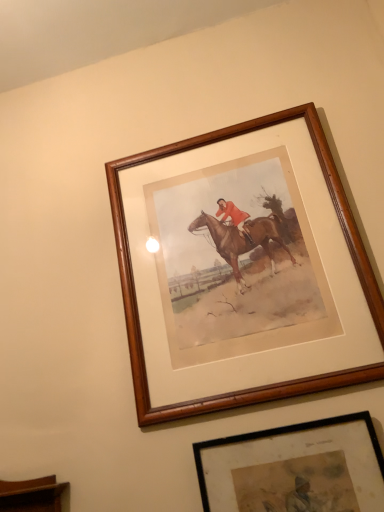
Image resolution: width=384 pixels, height=512 pixels. What do you see at coordinates (135, 290) in the screenshot? I see `wooden frame at upper center, which appears as the 2th picture frame when ordered from the bottom` at bounding box center [135, 290].

In order to face wooden frame at upper center, which appears as the 2th picture frame when ordered from the bottom, should I rotate leftwards or rightwards?

Turn right by 5.523 degrees to look at wooden frame at upper center, which appears as the 2th picture frame when ordered from the bottom.

Locate an element on the screen. This screenshot has width=384, height=512. wooden frame at upper center, marked as the first picture frame in a top-to-bottom arrangement is located at coordinates (135, 290).

What do you see at coordinates (294, 468) in the screenshot?
I see `wooden framed print at center, placed as the second picture frame when sorted from top to bottom` at bounding box center [294, 468].

Where is `wooden framed print at center, the first picture frame ordered from the bottom`? The image size is (384, 512). wooden framed print at center, the first picture frame ordered from the bottom is located at coordinates (294, 468).

This screenshot has width=384, height=512. I want to click on wooden frame at upper center, marked as the first picture frame in a top-to-bottom arrangement, so click(135, 290).

Considering the relative positions of wooden frame at upper center, marked as the first picture frame in a top-to-bottom arrangement, and wooden framed print at center, placed as the second picture frame when sorted from top to bottom, in the image provided, is wooden frame at upper center, marked as the first picture frame in a top-to-bottom arrangement, to the right of wooden framed print at center, placed as the second picture frame when sorted from top to bottom, from the viewer's perspective?

No.

Which object is further away from the camera, wooden frame at upper center, which appears as the 2th picture frame when ordered from the bottom, or wooden framed print at center, placed as the second picture frame when sorted from top to bottom?

wooden frame at upper center, which appears as the 2th picture frame when ordered from the bottom.

Which is closer, (130, 349) or (205, 462)?

The point (205, 462) is closer.

From the image's perspective, is wooden frame at upper center, marked as the first picture frame in a top-to-bottom arrangement, above wooden framed print at center, the first picture frame ordered from the bottom?

Yes, from the image's perspective, wooden frame at upper center, marked as the first picture frame in a top-to-bottom arrangement, is above wooden framed print at center, the first picture frame ordered from the bottom.

From a real-world perspective, who is located lower, wooden frame at upper center, marked as the first picture frame in a top-to-bottom arrangement, or wooden framed print at center, placed as the second picture frame when sorted from top to bottom?

wooden framed print at center, placed as the second picture frame when sorted from top to bottom, from a real-world perspective.

Which object is wider, wooden frame at upper center, marked as the first picture frame in a top-to-bottom arrangement, or wooden framed print at center, the first picture frame ordered from the bottom?

wooden frame at upper center, marked as the first picture frame in a top-to-bottom arrangement.

Considering the relative sizes of wooden frame at upper center, marked as the first picture frame in a top-to-bottom arrangement, and wooden framed print at center, placed as the second picture frame when sorted from top to bottom, in the image provided, is wooden frame at upper center, marked as the first picture frame in a top-to-bottom arrangement, taller than wooden framed print at center, placed as the second picture frame when sorted from top to bottom,?

Indeed, wooden frame at upper center, marked as the first picture frame in a top-to-bottom arrangement, has a greater height compared to wooden framed print at center, placed as the second picture frame when sorted from top to bottom.

Which of these two, wooden frame at upper center, which appears as the 2th picture frame when ordered from the bottom, or wooden framed print at center, placed as the second picture frame when sorted from top to bottom, is smaller?

Smaller between the two is wooden framed print at center, placed as the second picture frame when sorted from top to bottom.

Would you say wooden frame at upper center, which appears as the 2th picture frame when ordered from the bottom, is outside wooden framed print at center, the first picture frame ordered from the bottom?

Yes, wooden frame at upper center, which appears as the 2th picture frame when ordered from the bottom, is located beyond the bounds of wooden framed print at center, the first picture frame ordered from the bottom.

Is wooden frame at upper center, which appears as the 2th picture frame when ordered from the bottom, not near wooden framed print at center, placed as the second picture frame when sorted from top to bottom?

That's not correct — wooden frame at upper center, which appears as the 2th picture frame when ordered from the bottom, is a little close to wooden framed print at center, placed as the second picture frame when sorted from top to bottom.

Is wooden frame at upper center, which appears as the 2th picture frame when ordered from the bottom, looking in the opposite direction of wooden framed print at center, placed as the second picture frame when sorted from top to bottom?

No, wooden frame at upper center, which appears as the 2th picture frame when ordered from the bottom, is not facing the opposite direction of wooden framed print at center, placed as the second picture frame when sorted from top to bottom.

How distant is wooden frame at upper center, which appears as the 2th picture frame when ordered from the bottom, from wooden framed print at center, the first picture frame ordered from the bottom?

wooden frame at upper center, which appears as the 2th picture frame when ordered from the bottom, and wooden framed print at center, the first picture frame ordered from the bottom, are 19.43 centimeters apart from each other.

Identify the location of picture frame below the wooden frame at upper center, marked as the first picture frame in a top-to-bottom arrangement (from the image's perspective). (294, 468).

Is wooden framed print at center, the first picture frame ordered from the bottom, to the left or to the right of wooden frame at upper center, which appears as the 2th picture frame when ordered from the bottom, in the image?

In the image, wooden framed print at center, the first picture frame ordered from the bottom, appears on the right side of wooden frame at upper center, which appears as the 2th picture frame when ordered from the bottom.

Is the position of wooden framed print at center, the first picture frame ordered from the bottom, less distant than that of wooden frame at upper center, which appears as the 2th picture frame when ordered from the bottom?

Yes, wooden framed print at center, the first picture frame ordered from the bottom, is closer to the camera.

Which point is more distant from viewer, (252, 480) or (202, 405)?

The point (202, 405) is farther from the camera.

From the image's perspective, does wooden framed print at center, the first picture frame ordered from the bottom, appear lower than wooden frame at upper center, which appears as the 2th picture frame when ordered from the bottom?

Indeed, from the image's perspective, wooden framed print at center, the first picture frame ordered from the bottom, is shown beneath wooden frame at upper center, which appears as the 2th picture frame when ordered from the bottom.

From a real-world perspective, which is physically above, wooden framed print at center, placed as the second picture frame when sorted from top to bottom, or wooden frame at upper center, marked as the first picture frame in a top-to-bottom arrangement?

wooden frame at upper center, marked as the first picture frame in a top-to-bottom arrangement, from a real-world perspective.

Which object is wider, wooden framed print at center, placed as the second picture frame when sorted from top to bottom, or wooden frame at upper center, marked as the first picture frame in a top-to-bottom arrangement?

wooden frame at upper center, marked as the first picture frame in a top-to-bottom arrangement, is wider.

Considering the relative sizes of wooden framed print at center, the first picture frame ordered from the bottom, and wooden frame at upper center, which appears as the 2th picture frame when ordered from the bottom, in the image provided, is wooden framed print at center, the first picture frame ordered from the bottom, taller than wooden frame at upper center, which appears as the 2th picture frame when ordered from the bottom,?

No, wooden framed print at center, the first picture frame ordered from the bottom, is not taller than wooden frame at upper center, which appears as the 2th picture frame when ordered from the bottom.

Is wooden framed print at center, the first picture frame ordered from the bottom, bigger or smaller than wooden frame at upper center, which appears as the 2th picture frame when ordered from the bottom?

Clearly, wooden framed print at center, the first picture frame ordered from the bottom, is smaller in size than wooden frame at upper center, which appears as the 2th picture frame when ordered from the bottom.

Is wooden frame at upper center, which appears as the 2th picture frame when ordered from the bottom, inside wooden framed print at center, the first picture frame ordered from the bottom?

No, wooden framed print at center, the first picture frame ordered from the bottom, does not contain wooden frame at upper center, which appears as the 2th picture frame when ordered from the bottom.

Is the surface of wooden framed print at center, the first picture frame ordered from the bottom, in direct contact with wooden frame at upper center, which appears as the 2th picture frame when ordered from the bottom?

No, wooden framed print at center, the first picture frame ordered from the bottom, is not beside wooden frame at upper center, which appears as the 2th picture frame when ordered from the bottom.

Is wooden framed print at center, placed as the second picture frame when sorted from top to bottom, oriented towards wooden frame at upper center, marked as the first picture frame in a top-to-bottom arrangement?

No.

Can you tell me how much wooden framed print at center, placed as the second picture frame when sorted from top to bottom, and wooden frame at upper center, which appears as the 2th picture frame when ordered from the bottom, differ in facing direction?

There is a 0.0147-degree angle between the facing directions of wooden framed print at center, placed as the second picture frame when sorted from top to bottom, and wooden frame at upper center, which appears as the 2th picture frame when ordered from the bottom.

In the image, there is a wooden framed print at center, the first picture frame ordered from the bottom. Where is `picture frame above it (from the image's perspective)`? The height and width of the screenshot is (512, 384). picture frame above it (from the image's perspective) is located at coordinates (135, 290).

The image size is (384, 512). Identify the location of picture frame on the left of wooden framed print at center, the first picture frame ordered from the bottom. [135, 290].

Find the location of a particular element. The width and height of the screenshot is (384, 512). picture frame above the wooden framed print at center, the first picture frame ordered from the bottom (from a real-world perspective) is located at coordinates (135, 290).